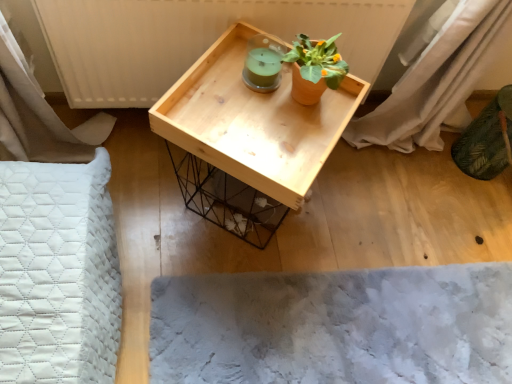
Locate an element on the screen. The image size is (512, 384). vacant space situated on the left part of terracotta clay pot at upper center is located at coordinates (230, 85).